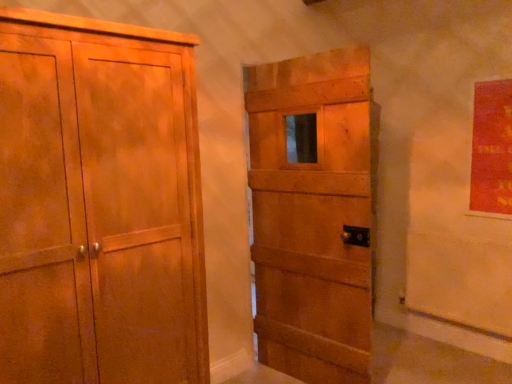
This screenshot has height=384, width=512. What do you see at coordinates (312, 214) in the screenshot? I see `matte wooden door at center` at bounding box center [312, 214].

Identify the location of matte wooden door at center. (312, 214).

This screenshot has height=384, width=512. I want to click on matte wood cupboard at left, so click(100, 204).

What is the approximate width of matte wood cupboard at left?

The width of matte wood cupboard at left is 24.07 inches.

What do you see at coordinates (100, 204) in the screenshot? The image size is (512, 384). I see `matte wood cupboard at left` at bounding box center [100, 204].

The width and height of the screenshot is (512, 384). Find the location of `matte wooden door at center`. matte wooden door at center is located at coordinates (312, 214).

Is matte wood cupboard at left to the left of matte wooden door at center from the viewer's perspective?

Correct, you'll find matte wood cupboard at left to the left of matte wooden door at center.

Does matte wood cupboard at left lie behind matte wooden door at center?

No, it is in front of matte wooden door at center.

Does point (92, 159) appear closer or farther from the camera than point (323, 186)?

Clearly, point (92, 159) is closer to the camera than point (323, 186).

From the image's perspective, would you say matte wood cupboard at left is shown under matte wooden door at center?

Yes, from the image's perspective, matte wood cupboard at left is below matte wooden door at center.

From a real-world perspective, is matte wood cupboard at left above or below matte wooden door at center?

In terms of real-world spatial position, matte wood cupboard at left is above matte wooden door at center.

Looking at their sizes, would you say matte wood cupboard at left is wider or thinner than matte wooden door at center?

matte wood cupboard at left is wider than matte wooden door at center.

Which of these two, matte wood cupboard at left or matte wooden door at center, stands taller?

matte wooden door at center is taller.

Between matte wood cupboard at left and matte wooden door at center, which one has larger size?

matte wood cupboard at left.

Is matte wood cupboard at left inside or outside of matte wooden door at center?

matte wood cupboard at left cannot be found inside matte wooden door at center.

Is matte wood cupboard at left placed right next to matte wooden door at center?

No, matte wood cupboard at left is not in contact with matte wooden door at center.

Does matte wood cupboard at left turn towards matte wooden door at center?

No, matte wood cupboard at left is not turned towards matte wooden door at center.

How far apart are matte wood cupboard at left and matte wooden door at center?

matte wood cupboard at left is 3.44 feet away from matte wooden door at center.

Where is `cupboard that appears on the left of matte wooden door at center`? cupboard that appears on the left of matte wooden door at center is located at coordinates (100, 204).

Which is more to the left, matte wooden door at center or matte wood cupboard at left?

From the viewer's perspective, matte wood cupboard at left appears more on the left side.

Is matte wooden door at center further to camera compared to matte wood cupboard at left?

Yes, it is behind matte wood cupboard at left.

Which is farther from the camera, (273, 103) or (34, 14)?

Point (273, 103)

From the image's perspective, is matte wooden door at center located above matte wood cupboard at left?

Yes.

From a real-world perspective, is matte wooden door at center on top of matte wood cupboard at left?

No, from a real-world perspective, matte wooden door at center is not above matte wood cupboard at left.

Considering the sizes of objects matte wooden door at center and matte wood cupboard at left in the image provided, who is thinner, matte wooden door at center or matte wood cupboard at left?

matte wooden door at center is thinner.

Which of these two, matte wooden door at center or matte wood cupboard at left, stands taller?

Standing taller between the two is matte wooden door at center.

Can you confirm if matte wooden door at center is smaller than matte wood cupboard at left?

Yes, matte wooden door at center is smaller than matte wood cupboard at left.

Is matte wooden door at center not within matte wood cupboard at left?

Yes, matte wooden door at center is not within matte wood cupboard at left.

Are matte wooden door at center and matte wood cupboard at left located far from each other?

Yes, matte wooden door at center and matte wood cupboard at left are quite far apart.

Could you tell me if matte wooden door at center is turned towards matte wood cupboard at left?

Yes, matte wooden door at center faces towards matte wood cupboard at left.

Measure the distance between matte wooden door at center and matte wood cupboard at left.

The distance of matte wooden door at center from matte wood cupboard at left is 1.05 meters.

Find the location of a particular element. door below the matte wood cupboard at left (from a real-world perspective) is located at coordinates point(312,214).

I want to click on cupboard in front of the matte wooden door at center, so click(100, 204).

Identify the location of cupboard located above the matte wooden door at center (from a real-world perspective). (100, 204).